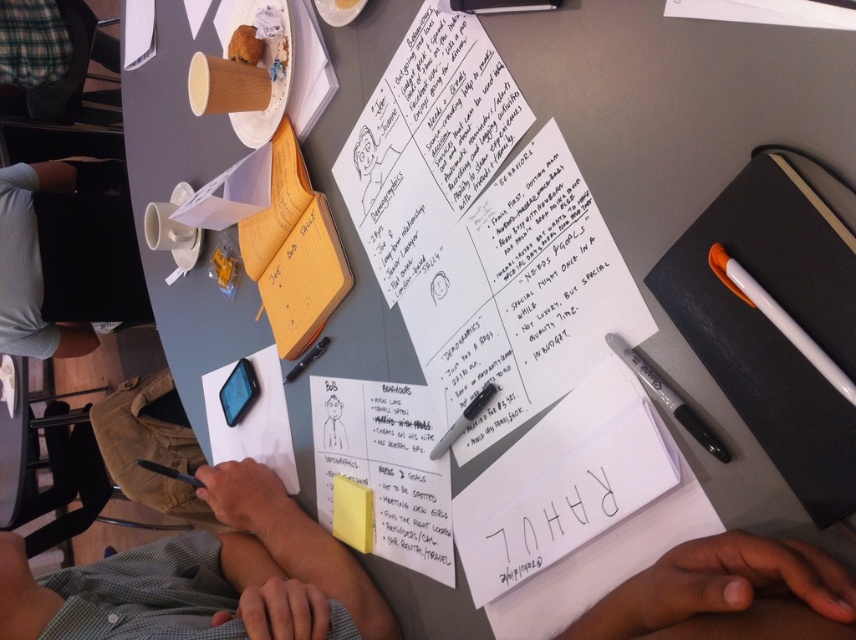
Who is taller, yellow sticky note at center or black plastic pen at center?

yellow sticky note at center

Measure the distance between point (345, 531) and camera.

A distance of 79.96 centimeters exists between point (345, 531) and camera.

Is point (336, 476) closer to viewer compared to point (311, 349)?

Yes, it is.

Where is `yellow sticky note at center`? Image resolution: width=856 pixels, height=640 pixels. yellow sticky note at center is located at coordinates (352, 513).

Is green shirt at lower center taller than black fabric shirt at left?

No, green shirt at lower center is not taller than black fabric shirt at left.

Who is positioned more to the right, green shirt at lower center or black fabric shirt at left?

Positioned to the right is green shirt at lower center.

Who is more distant from viewer, [810,636] or [36,326]?

The point [36,326] is behind.

Identify the location of green shirt at lower center. Image resolution: width=856 pixels, height=640 pixels. (726, 593).

Is black fabric shirt at left bigger than black glossy pen at center?

Yes.

Is black fabric shirt at left in front of black glossy pen at center?

No, black fabric shirt at left is further to the viewer.

The height and width of the screenshot is (640, 856). Identify the location of black fabric shirt at left. (63, 259).